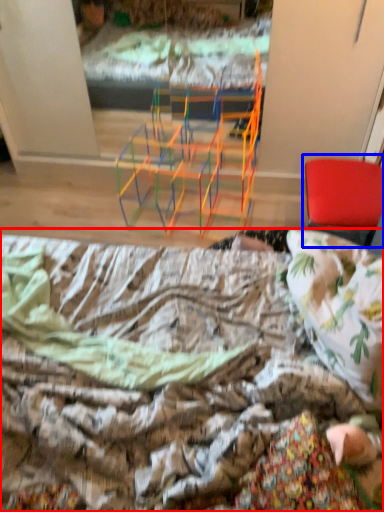
Question: Which point is closer to the camera, bed (highlighted by a red box) or chair (highlighted by a blue box)?

Choices:
 (A) bed
 (B) chair

Answer: (A)